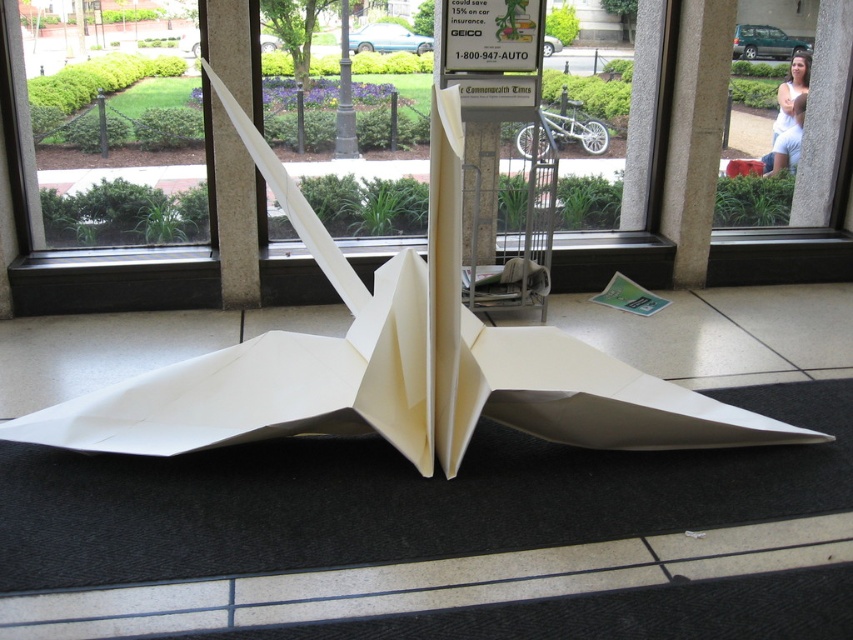
Question: Is white stone pillar at upper right further to camera compared to white paper airplane at center?

Choices:
 (A) yes
 (B) no

Answer: (A)

Question: Does white paper airplane at center appear over black metal pole at center?

Choices:
 (A) yes
 (B) no

Answer: (B)

Question: Which point is farther to the camera?

Choices:
 (A) white stone pillar at upper right
 (B) white paper airplane at center

Answer: (A)

Question: Is white stone pillar at upper right to the right of black metal pole at center from the viewer's perspective?

Choices:
 (A) no
 (B) yes

Answer: (B)

Question: Which point is farther to the camera?

Choices:
 (A) (221, 4)
 (B) (664, 179)

Answer: (B)

Question: Which object is the closest to the black metal pole at center?

Choices:
 (A) white stone pillar at upper right
 (B) white paper airplane at center

Answer: (A)